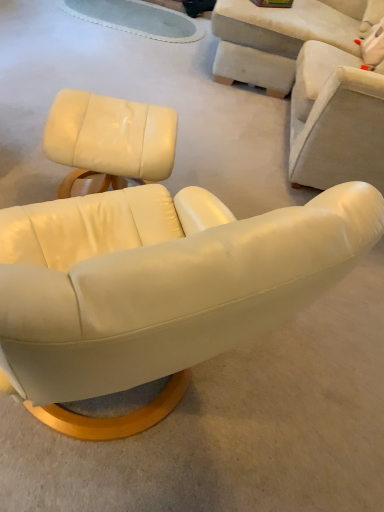
Question: In which direction should I rotate to look at matte white leather chair at center, the second chair in the left-to-right sequence?

Choices:
 (A) left
 (B) right

Answer: (A)

Question: Is matte white armchair at upper right, the 3th chair viewed from the left, looking in the opposite direction of matte white leather chair at center, the second chair viewed from the right?

Choices:
 (A) no
 (B) yes

Answer: (A)

Question: Can you confirm if matte white armchair at upper right, the 3th chair viewed from the left, is bigger than matte white leather chair at center, the second chair viewed from the right?

Choices:
 (A) no
 (B) yes

Answer: (A)

Question: Can you confirm if matte white armchair at upper right, which appears as the first chair when viewed from the right, is thinner than matte white leather chair at center, the second chair viewed from the right?

Choices:
 (A) yes
 (B) no

Answer: (A)

Question: From the image's perspective, is matte white armchair at upper right, the 3th chair viewed from the left, below matte white leather chair at center, the second chair in the left-to-right sequence?

Choices:
 (A) no
 (B) yes

Answer: (B)

Question: Is matte white armchair at upper right, the 3th chair viewed from the left, surrounding matte white leather chair at center, the second chair in the left-to-right sequence?

Choices:
 (A) no
 (B) yes

Answer: (A)

Question: Does matte white armchair at upper right, which appears as the first chair when viewed from the right, have a smaller size compared to matte white leather chair at center, the second chair in the left-to-right sequence?

Choices:
 (A) yes
 (B) no

Answer: (A)

Question: Is matte white leather chair at center, the second chair viewed from the right, further to camera compared to matte white leather ottoman at upper left, the 3th chair positioned from the right?

Choices:
 (A) no
 (B) yes

Answer: (A)

Question: Can you confirm if matte white leather chair at center, the second chair viewed from the right, is wider than matte white leather ottoman at upper left, placed as the first chair when sorted from left to right?

Choices:
 (A) yes
 (B) no

Answer: (A)

Question: Is matte white leather chair at center, the second chair viewed from the right, in contact with matte white leather ottoman at upper left, placed as the first chair when sorted from left to right?

Choices:
 (A) no
 (B) yes

Answer: (A)

Question: Can you confirm if matte white leather chair at center, the second chair viewed from the right, is taller than matte white leather ottoman at upper left, placed as the first chair when sorted from left to right?

Choices:
 (A) yes
 (B) no

Answer: (B)

Question: Does matte white leather chair at center, the second chair in the left-to-right sequence, appear on the left side of matte white leather ottoman at upper left, placed as the first chair when sorted from left to right?

Choices:
 (A) yes
 (B) no

Answer: (B)

Question: Is matte white leather chair at center, the second chair in the left-to-right sequence, looking in the opposite direction of matte white leather ottoman at upper left, the 3th chair positioned from the right?

Choices:
 (A) no
 (B) yes

Answer: (A)

Question: Is matte white leather ottoman at upper left, placed as the first chair when sorted from left to right, further to camera compared to matte white armchair at upper right, which appears as the first chair when viewed from the right?

Choices:
 (A) yes
 (B) no

Answer: (B)